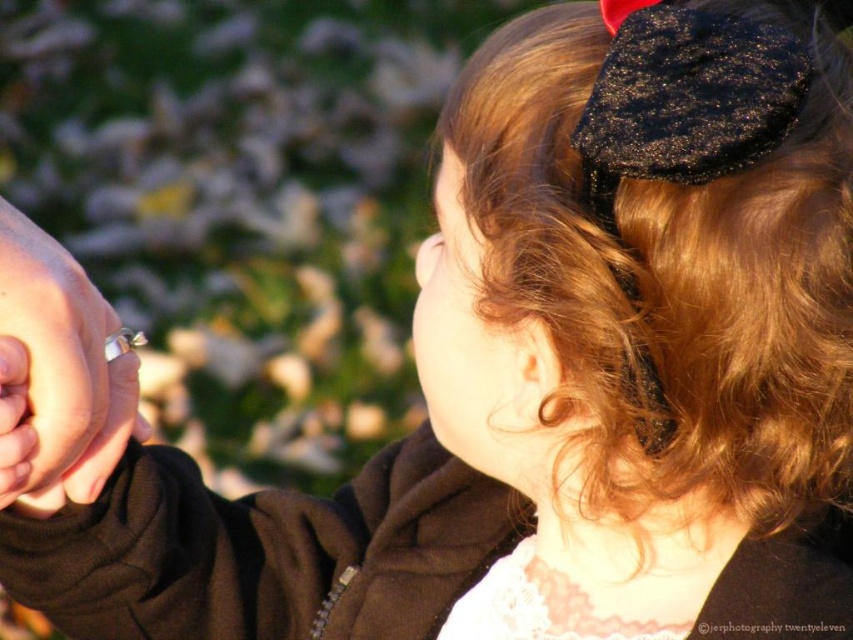
Question: Is shiny brown hair at upper right closer to the viewer compared to silver metallic ring at left?

Choices:
 (A) no
 (B) yes

Answer: (B)

Question: Which point is farther to the camera?

Choices:
 (A) (844, 141)
 (B) (113, 456)

Answer: (B)

Question: Is shiny brown hair at upper right to the right of silver metallic ring at left from the viewer's perspective?

Choices:
 (A) no
 (B) yes

Answer: (B)

Question: Which point appears closest to the camera in this image?

Choices:
 (A) (682, 376)
 (B) (48, 512)

Answer: (A)

Question: Can you confirm if shiny brown hair at upper right is positioned below silver metallic ring at left?

Choices:
 (A) yes
 (B) no

Answer: (B)